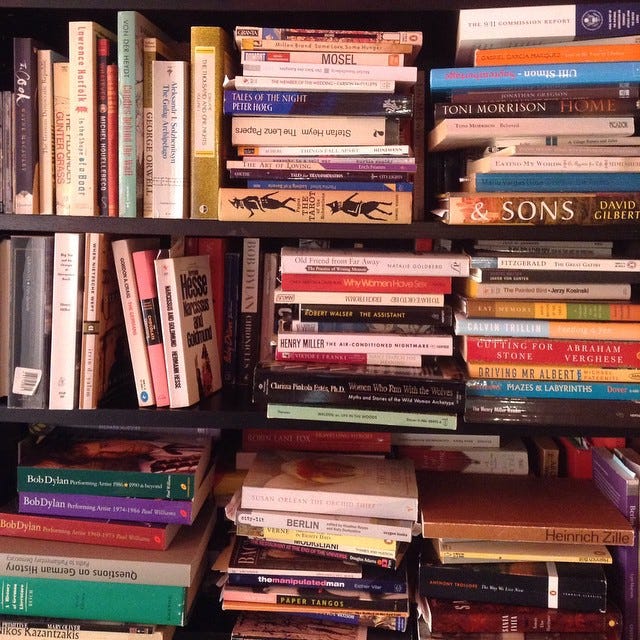
Identify the location of books left side lower shelf. (132, 474), (168, 502), (108, 530), (91, 566), (116, 598), (79, 621), (138, 636).